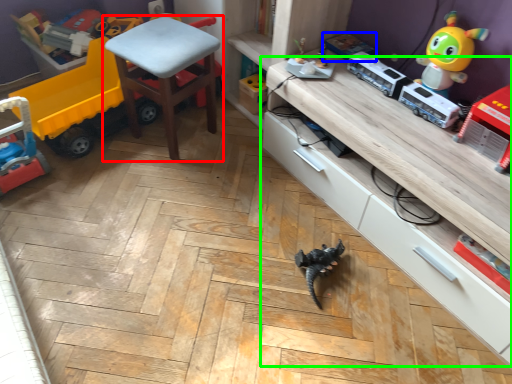
Question: Estimate the real-world distances between objects in this image. Which object is closer to chair (highlighted by a red box), toy (highlighted by a blue box) or cabinetry (highlighted by a green box)?

Choices:
 (A) toy
 (B) cabinetry

Answer: (A)